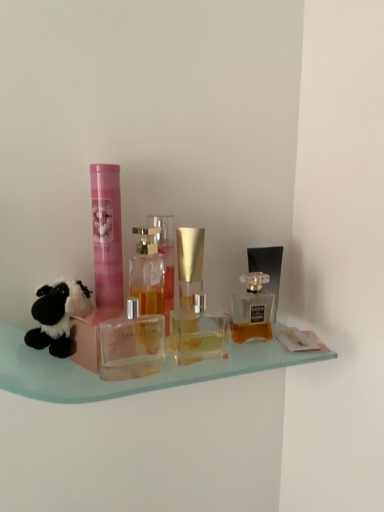
Question: Is matte black perfume at right, the 1th toiletry from the back, completely or partially inside transparent glass perfume bottle at center, which appears as the third bottle when viewed from the left?

Choices:
 (A) yes
 (B) no

Answer: (B)

Question: Can you confirm if transparent glass perfume bottle at center, which appears as the third bottle when viewed from the left, is thinner than matte black perfume at right, the 1th toiletry from the back?

Choices:
 (A) yes
 (B) no

Answer: (B)

Question: Does transparent glass perfume bottle at center, which appears as the third bottle when viewed from the left, have a larger size compared to matte black perfume at right, acting as the first toiletry starting from the right?

Choices:
 (A) no
 (B) yes

Answer: (A)

Question: From the image's perspective, is transparent glass perfume bottle at center, which appears as the third bottle when viewed from the left, beneath matte black perfume at right, which is counted as the 2th toiletry, starting from the left?

Choices:
 (A) yes
 (B) no

Answer: (A)

Question: From a real-world perspective, is transparent glass perfume bottle at center, which is counted as the 2th bottle, starting from the right, over matte black perfume at right, the 1th toiletry from the back?

Choices:
 (A) no
 (B) yes

Answer: (A)

Question: Considering the relative sizes of transparent glass perfume bottle at center, which appears as the third bottle when viewed from the left, and matte black perfume at right, which is counted as the 2th toiletry, starting from the left, in the image provided, is transparent glass perfume bottle at center, which appears as the third bottle when viewed from the left, wider than matte black perfume at right, which is counted as the 2th toiletry, starting from the left,?

Choices:
 (A) yes
 (B) no

Answer: (A)

Question: Does clear glass perfume bottle at center, positioned as the fourth bottle in right-to-left order, lie behind clear glass perfume bottle at center, positioned as the second bottle in left-to-right order?

Choices:
 (A) no
 (B) yes

Answer: (A)

Question: Is clear glass perfume bottle at center, which is the 1th bottle from left to right, far away from clear glass perfume bottle at center, positioned as the second bottle in left-to-right order?

Choices:
 (A) no
 (B) yes

Answer: (A)

Question: Could clear glass perfume bottle at center, which appears as the 3th bottle when viewed from the right, be considered to be inside clear glass perfume bottle at center, positioned as the fourth bottle in right-to-left order?

Choices:
 (A) no
 (B) yes

Answer: (A)

Question: From the image's perspective, is clear glass perfume bottle at center, positioned as the fourth bottle in right-to-left order, located beneath clear glass perfume bottle at center, which appears as the 3th bottle when viewed from the right?

Choices:
 (A) yes
 (B) no

Answer: (A)

Question: From the image's perspective, would you say clear glass perfume bottle at center, which is the 1th bottle from left to right, is positioned over clear glass perfume bottle at center, which appears as the 3th bottle when viewed from the right?

Choices:
 (A) yes
 (B) no

Answer: (B)

Question: Can you confirm if clear glass perfume bottle at center, positioned as the fourth bottle in right-to-left order, is smaller than clear glass perfume bottle at center, positioned as the second bottle in left-to-right order?

Choices:
 (A) no
 (B) yes

Answer: (A)

Question: Is matte black perfume at right, acting as the first toiletry starting from the right, behind clear glass perfume bottle at center, which appears as the 3th bottle when viewed from the right?

Choices:
 (A) yes
 (B) no

Answer: (A)